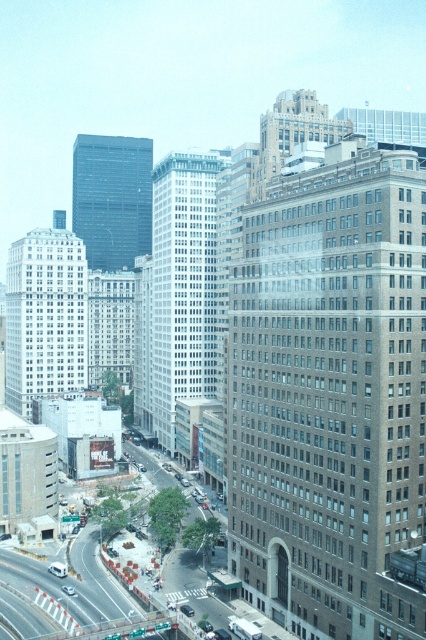
Does white matte van at lower left appear over silver metallic sedan at center?

Indeed, white matte van at lower left is positioned over silver metallic sedan at center.

Is white matte van at lower left positioned in front of silver metallic sedan at center?

No.

Identify the location of white matte van at lower left. This screenshot has width=426, height=640. tap(57, 568).